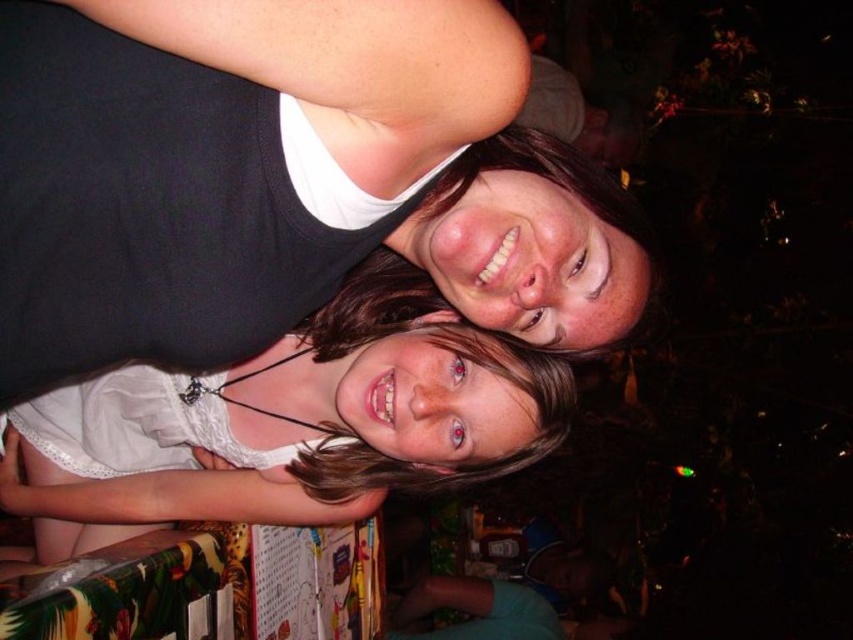
Can you confirm if matte black tank top at upper center is smaller than white lace dress at center?

Yes, matte black tank top at upper center is smaller than white lace dress at center.

Between matte black tank top at upper center and white lace dress at center, which one is positioned lower?

white lace dress at center

Is point (314, 268) positioned before point (506, 460)?

Yes, it is in front of point (506, 460).

I want to click on matte black tank top at upper center, so click(x=283, y=180).